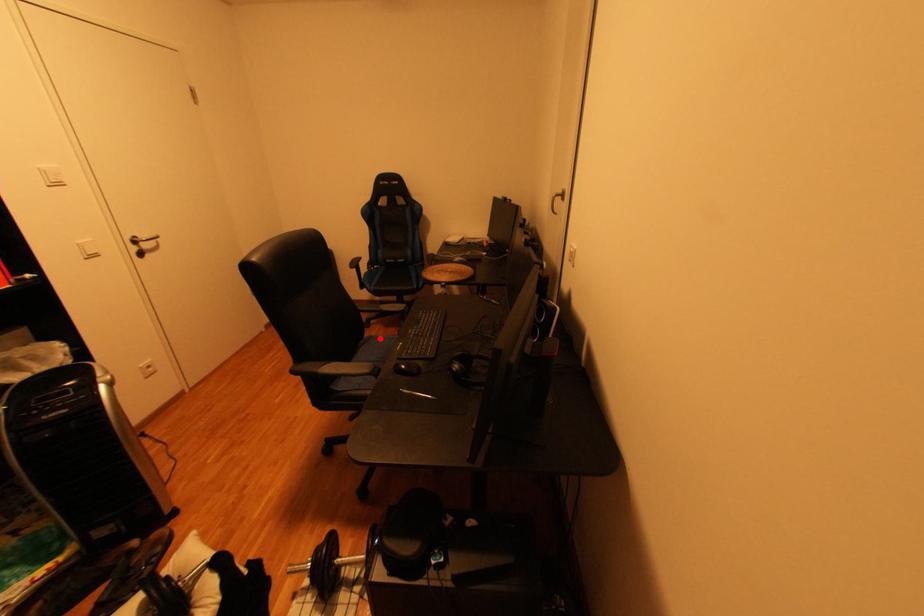
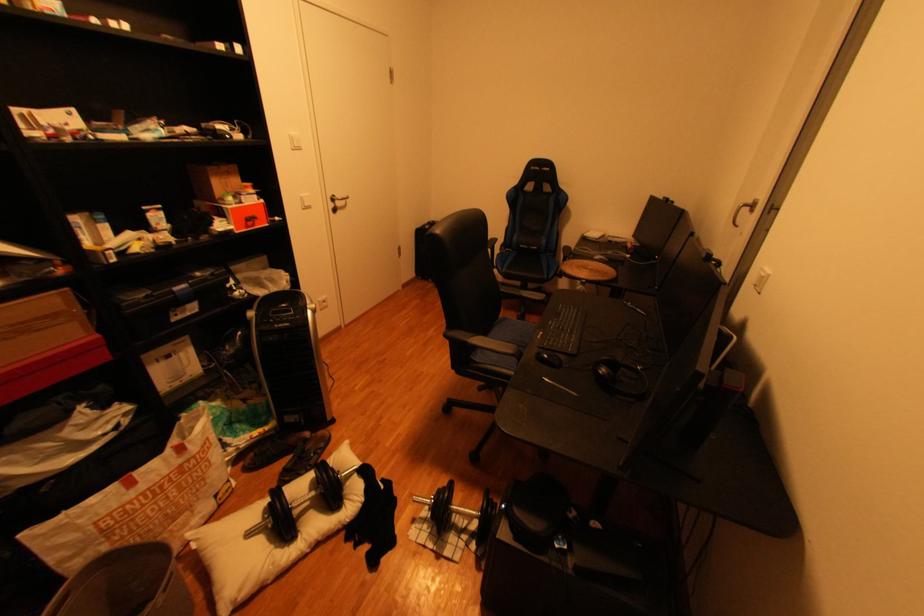
Question: I am providing you with two images of the same scene from different viewpoints. Image1 has a red point marked. In image2, the corresponding 3D location appears at what relative position? Reply with the corresponding letter.

Choices:
 (A) Closer
 (B) Farther

Answer: (A)